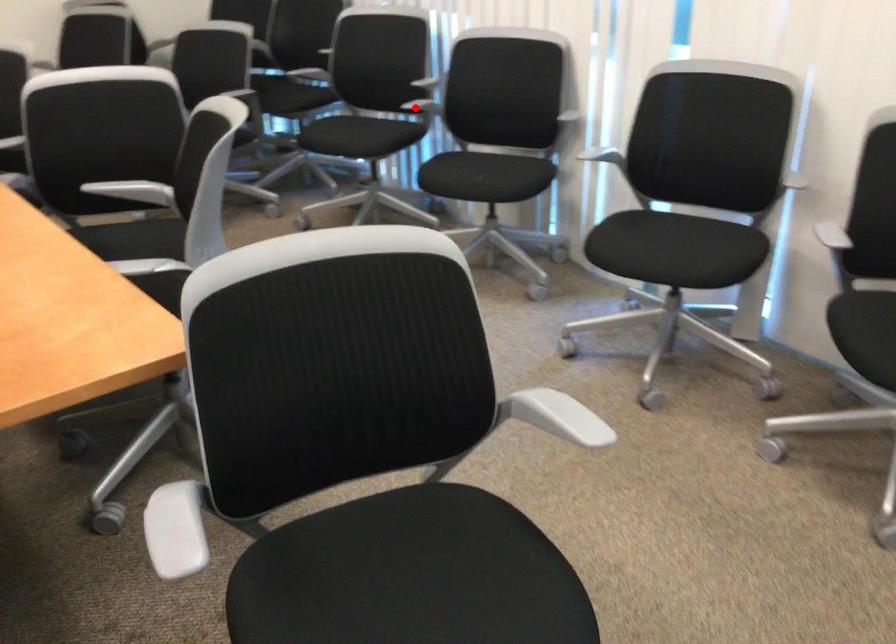
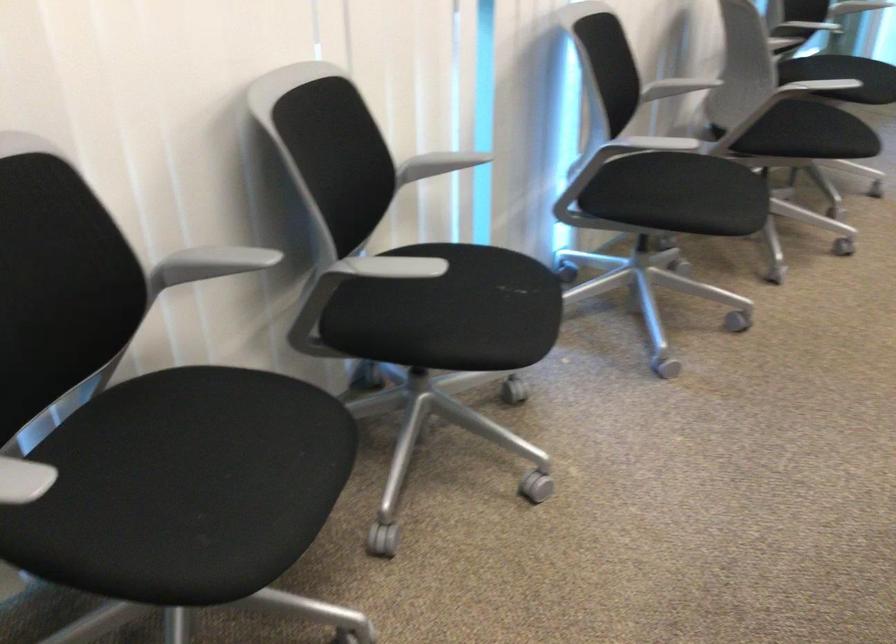
Question: A red point is marked in image1. In image2, is the corresponding 3D point closer to the camera or farther? Reply with the corresponding letter.

Choices:
 (A) The corresponding 3D point is closer.
 (B) The corresponding 3D point is farther.

Answer: (A)